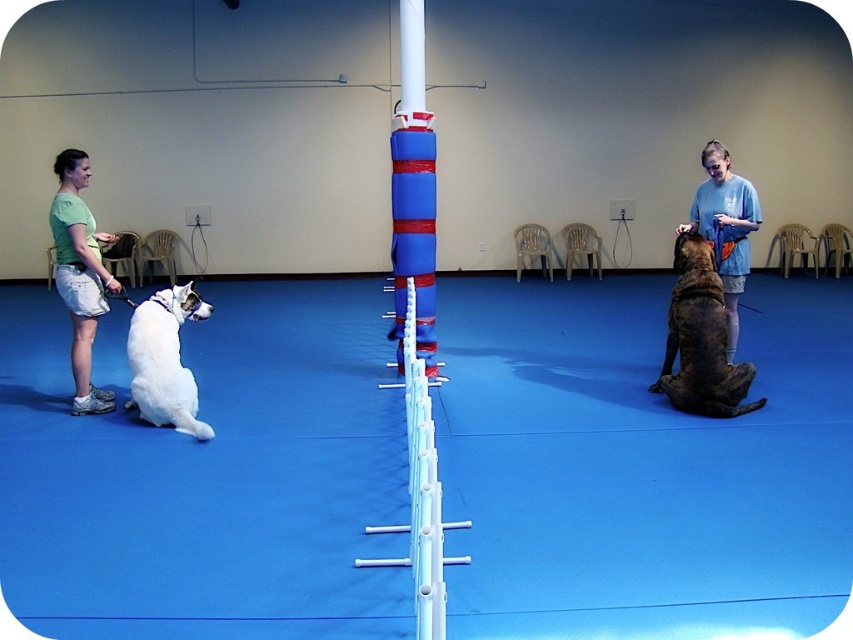
Question: Which of the following is the farthest from the observer?

Choices:
 (A) (106, 401)
 (B) (682, 324)

Answer: (A)

Question: Is brown fur dog at right to the right of white fur dog at left from the viewer's perspective?

Choices:
 (A) yes
 (B) no

Answer: (A)

Question: Which object is the closest to the brown fur dog at right?

Choices:
 (A) white fur dog at left
 (B) green cotton shirt at left

Answer: (A)

Question: Which of the following is the farthest from the observer?

Choices:
 (A) (149, 378)
 (B) (697, 369)

Answer: (B)

Question: Does green cotton shirt at left appear on the left side of white fur dog at left?

Choices:
 (A) yes
 (B) no

Answer: (A)

Question: Can you confirm if brown fur dog at right is smaller than white fur dog at left?

Choices:
 (A) yes
 (B) no

Answer: (A)